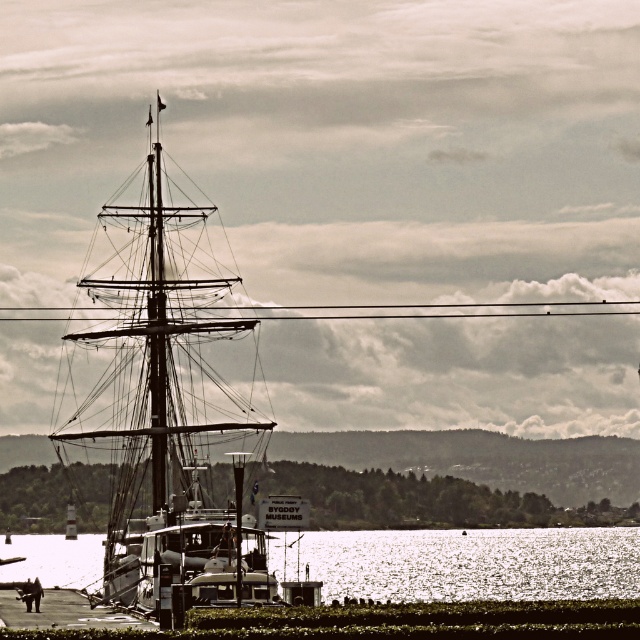
You are a tour guide explaining the scene to visitors. Pointing to the wooden ship at center and the glistening silver water at lower center, you want to describe their spatial relationship. How would you phrase it?

The wooden ship at center is positioned in front of the glistening silver water at lower center, meaning the ship appears closer to the viewer while the water is situated behind it in the scene.

You are a tour guide standing at the pier and want to direct visitors to the wooden ship at center. Since you can only describe its location using coordinates, what are the coordinates you should mention?

The wooden ship at center is located at coordinates point (x=163, y=397).